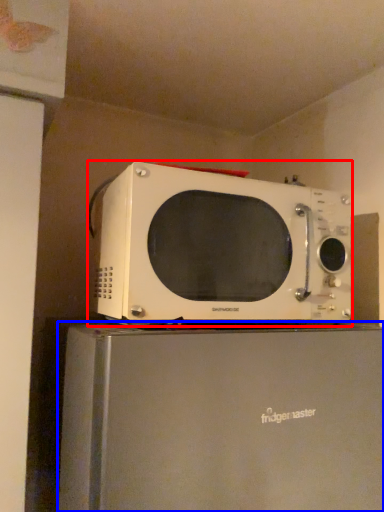
Question: Which object is closer to the camera taking this photo, microwave oven (highlighted by a red box) or appliance (highlighted by a blue box)?

Choices:
 (A) microwave oven
 (B) appliance

Answer: (B)